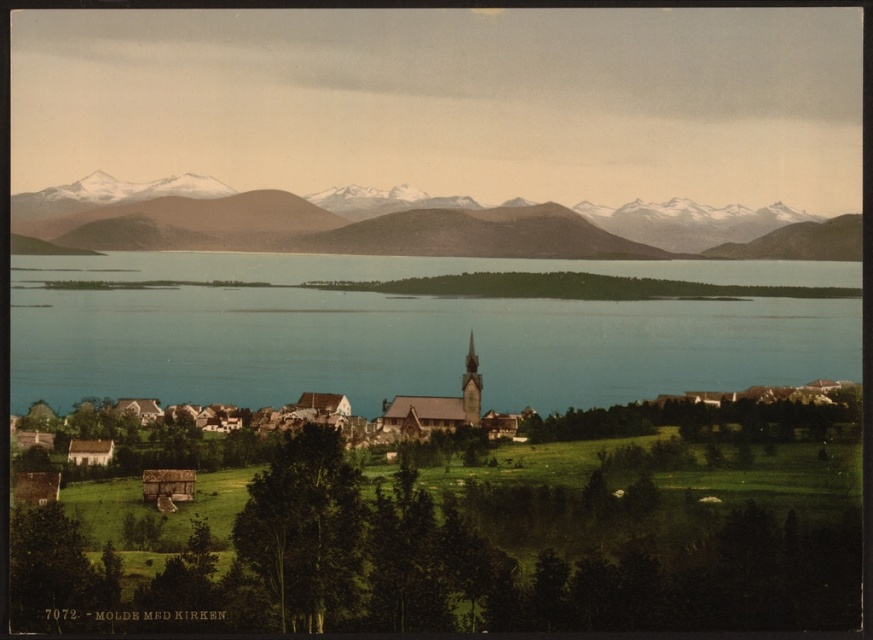
Question: Does blue water at center have a greater width compared to brown wooden spire at center?

Choices:
 (A) yes
 (B) no

Answer: (A)

Question: Can you confirm if blue water at center is bigger than brown wooden spire at center?

Choices:
 (A) no
 (B) yes

Answer: (B)

Question: Which point appears farthest from the camera in this image?

Choices:
 (A) (677, 352)
 (B) (476, 381)

Answer: (A)

Question: Which of these objects is positioned farthest from the blue water at center?

Choices:
 (A) brown textured mountains at upper center
 (B) brown wooden spire at center

Answer: (B)

Question: Does brown textured mountains at upper center have a greater width compared to brown wooden spire at center?

Choices:
 (A) no
 (B) yes

Answer: (B)

Question: Which point is closer to the camera?

Choices:
 (A) coord(38,198)
 (B) coord(468,349)

Answer: (B)